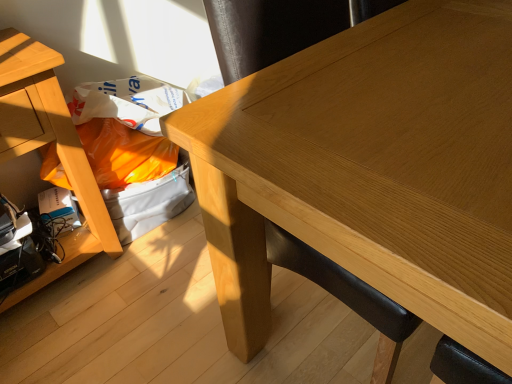
Question: Is light brown wood table at left, which appears as the 1th table when viewed from the left, to the left or to the right of light brown wood table at center, arranged as the second table when viewed from the left, in the image?

Choices:
 (A) right
 (B) left

Answer: (B)

Question: In terms of width, does light brown wood table at left, positioned as the second table in right-to-left order, look wider or thinner when compared to light brown wood table at center, which ranks as the first table in right-to-left order?

Choices:
 (A) thin
 (B) wide

Answer: (A)

Question: From a real-world perspective, relative to light brown wood table at center, which ranks as the first table in right-to-left order, is light brown wood table at left, positioned as the second table in right-to-left order, vertically above or below?

Choices:
 (A) below
 (B) above

Answer: (A)

Question: From their relative heights in the image, would you say light brown wood table at center, arranged as the second table when viewed from the left, is taller or shorter than light brown wood table at left, which appears as the 1th table when viewed from the left?

Choices:
 (A) tall
 (B) short

Answer: (A)

Question: From a real-world perspective, is light brown wood table at center, which ranks as the first table in right-to-left order, physically located above or below light brown wood table at left, which appears as the 1th table when viewed from the left?

Choices:
 (A) above
 (B) below

Answer: (A)

Question: From the image's perspective, is light brown wood table at center, which ranks as the first table in right-to-left order, located above or below light brown wood table at left, which appears as the 1th table when viewed from the left?

Choices:
 (A) above
 (B) below

Answer: (A)

Question: Based on their positions, is light brown wood table at center, which ranks as the first table in right-to-left order, located to the left or right of light brown wood table at left, which appears as the 1th table when viewed from the left?

Choices:
 (A) left
 (B) right

Answer: (B)